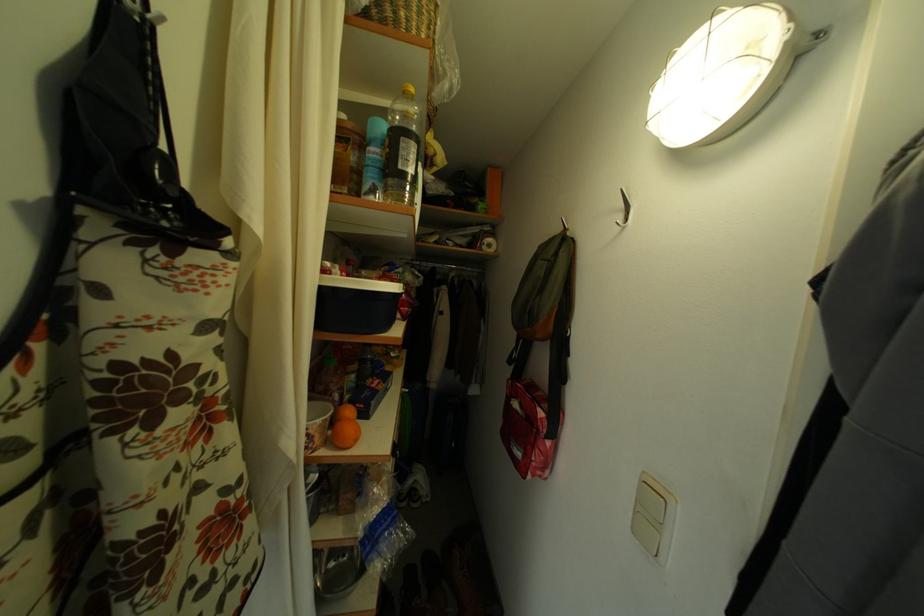
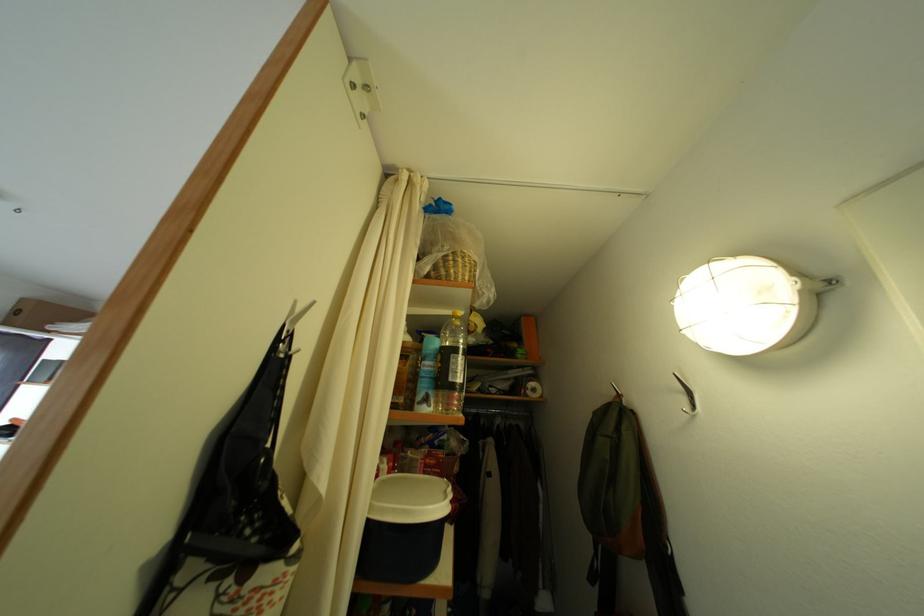
Question: What movement of the cameraman would produce the second image?

Choices:
 (A) Left
 (B) Right
 (C) Forward
 (D) Backward

Answer: (D)